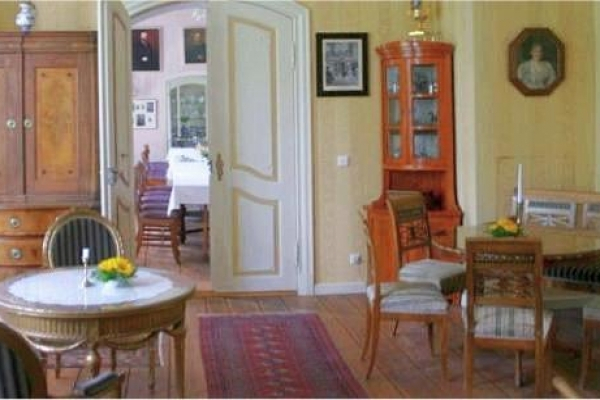
Image resolution: width=600 pixels, height=400 pixels. In order to click on door in this screenshot , I will do `click(231, 189)`, `click(121, 136)`.